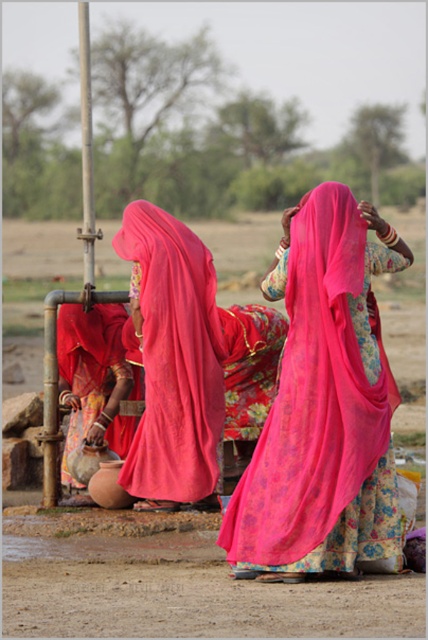
Question: Can you confirm if silky pink sari at center is smaller than matte clay pot at lower left?

Choices:
 (A) no
 (B) yes

Answer: (A)

Question: Which is farther from the matte clay pot at lower left?

Choices:
 (A) matte pink fabric at center
 (B) silky pink sari at center

Answer: (A)

Question: Which point is closer to the camera?

Choices:
 (A) matte clay pot at lower left
 (B) silky pink sari at center
 (C) matte pink fabric at center

Answer: (C)

Question: Can you confirm if matte pink fabric at center is positioned below silky pink sari at center?

Choices:
 (A) no
 (B) yes

Answer: (B)

Question: Which point appears farthest from the camera in this image?

Choices:
 (A) (x=258, y=387)
 (B) (x=121, y=364)
 (C) (x=296, y=492)

Answer: (B)

Question: Considering the relative positions of silky pink sari at center and matte clay pot at lower left in the image provided, where is silky pink sari at center located with respect to matte clay pot at lower left?

Choices:
 (A) left
 (B) right

Answer: (B)